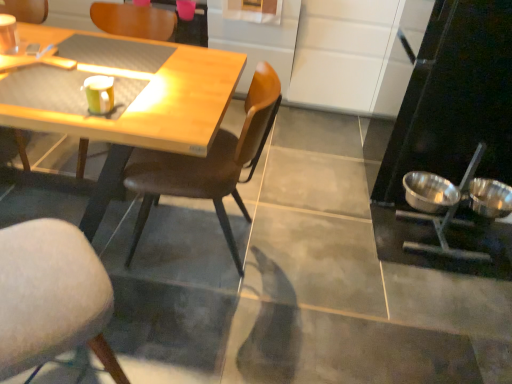
Question: Is point (185, 19) positioned closer to the camera than point (103, 87)?

Choices:
 (A) closer
 (B) farther

Answer: (B)

Question: Would you say pink matte coffee cup at upper center, the first coffee cup viewed from the back, is to the left or to the right of matte yellow cup at upper left, the 1th coffee cup when ordered from front to back, in the picture?

Choices:
 (A) right
 (B) left

Answer: (A)

Question: Which is farther from the wooden chair at center, the 3th chair in the right-to-left sequence?

Choices:
 (A) pink matte coffee cup at upper center, the 2th coffee cup ordered from the bottom
 (B) stainless steel bowls at right
 (C) matte yellow cup at upper left, the second coffee cup positioned from the back
 (D) matte brown chair at left, which is counted as the fourth chair, starting from the right
 (E) soft gray cushioned chair at lower left, which is the third chair in left-to-right order

Answer: (B)

Question: Which is nearer to the shiny metallic bowl at right, the 1th bowl viewed from the left?

Choices:
 (A) matte brown chair at left, the 1th chair positioned from the left
 (B) brown leather chair at center, which is counted as the fourth chair, starting from the left
 (C) soft gray cushioned chair at lower left, which is the third chair in left-to-right order
 (D) shiny metallic bowl at right, the second bowl positioned from the left
 (E) wooden chair at center, the 3th chair in the right-to-left sequence

Answer: (D)